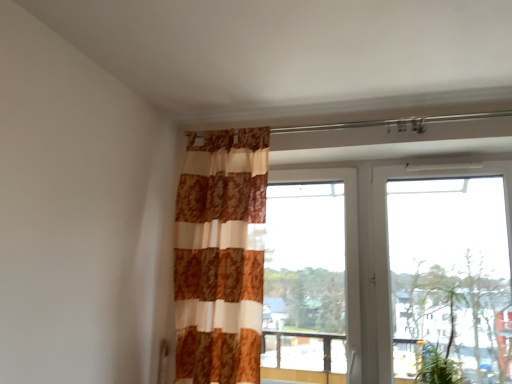
Where is `transparent glass window at center, acting as the 2th window starting from the right`? The width and height of the screenshot is (512, 384). transparent glass window at center, acting as the 2th window starting from the right is located at coordinates (345, 236).

At what (x,y) coordinates should I click in order to perform the action: click on white plastic window at upper right, the 1th window viewed from the right. Please return your answer as a coordinate pair (x, y). Looking at the image, I should click on (375, 250).

Is transparent glass window at center, acting as the 2th window starting from the right, positioned beyond the bounds of patterned fabric curtain at center?

Yes, transparent glass window at center, acting as the 2th window starting from the right, is located beyond the bounds of patterned fabric curtain at center.

Does transparent glass window at center, arranged as the 1th window when viewed from the left, appear on the right side of patterned fabric curtain at center?

Indeed, transparent glass window at center, arranged as the 1th window when viewed from the left, is positioned on the right side of patterned fabric curtain at center.

Are transparent glass window at center, acting as the 2th window starting from the right, and patterned fabric curtain at center making contact?

No, transparent glass window at center, acting as the 2th window starting from the right, is not next to patterned fabric curtain at center.

From the image's perspective, would you say transparent glass window at center, arranged as the 1th window when viewed from the left, is positioned over patterned fabric curtain at center?

No.

From the image's perspective, is green leafy plant at lower right located above or below transparent glass window at center, acting as the 2th window starting from the right?

green leafy plant at lower right is below transparent glass window at center, acting as the 2th window starting from the right.

Can you tell me how much green leafy plant at lower right and transparent glass window at center, arranged as the 1th window when viewed from the left, differ in facing direction?

The angular difference between green leafy plant at lower right and transparent glass window at center, arranged as the 1th window when viewed from the left, is 0.414 degrees.

Considering the positions of objects green leafy plant at lower right and transparent glass window at center, acting as the 2th window starting from the right, in the image provided, who is more to the left, green leafy plant at lower right or transparent glass window at center, acting as the 2th window starting from the right,?

Positioned to the left is transparent glass window at center, acting as the 2th window starting from the right.

Does transparent glass window at center, arranged as the 1th window when viewed from the left, turn towards white plastic window at upper right, the 1th window viewed from the right?

No, transparent glass window at center, arranged as the 1th window when viewed from the left, is not oriented towards white plastic window at upper right, the 1th window viewed from the right.

Measure the distance between transparent glass window at center, arranged as the 1th window when viewed from the left, and white plastic window at upper right, the 1th window viewed from the right.

transparent glass window at center, arranged as the 1th window when viewed from the left, is 4.02 inches away from white plastic window at upper right, the 1th window viewed from the right.

Would you say transparent glass window at center, arranged as the 1th window when viewed from the left, is inside or outside white plastic window at upper right, the 1th window viewed from the right?

The correct answer is: outside.

Where is `window directly beneath the white plastic window at upper right, the 2th window when ordered from left to right (from a real-world perspective)`? Image resolution: width=512 pixels, height=384 pixels. window directly beneath the white plastic window at upper right, the 2th window when ordered from left to right (from a real-world perspective) is located at coordinates (345, 236).

Is white plastic window at upper right, the 1th window viewed from the right, located outside patterned fabric curtain at center?

Yes, white plastic window at upper right, the 1th window viewed from the right, is outside of patterned fabric curtain at center.

Is white plastic window at upper right, the 1th window viewed from the right, wider than patterned fabric curtain at center?

No, white plastic window at upper right, the 1th window viewed from the right, is not wider than patterned fabric curtain at center.

Is the position of white plastic window at upper right, the 1th window viewed from the right, less distant than that of patterned fabric curtain at center?

Yes, white plastic window at upper right, the 1th window viewed from the right, is closer to the camera.

Who is shorter, white plastic window at upper right, the 2th window when ordered from left to right, or patterned fabric curtain at center?

Standing shorter between the two is white plastic window at upper right, the 2th window when ordered from left to right.

Is white plastic window at upper right, the 1th window viewed from the right, located outside transparent glass window at center, acting as the 2th window starting from the right?

Yes, white plastic window at upper right, the 1th window viewed from the right, is outside of transparent glass window at center, acting as the 2th window starting from the right.

From the image's perspective, which one is positioned lower, white plastic window at upper right, the 2th window when ordered from left to right, or transparent glass window at center, arranged as the 1th window when viewed from the left?

transparent glass window at center, arranged as the 1th window when viewed from the left.

Based on the photo, from a real-world perspective, is white plastic window at upper right, the 1th window viewed from the right, over transparent glass window at center, arranged as the 1th window when viewed from the left?

Yes, from a real-world perspective, white plastic window at upper right, the 1th window viewed from the right, is over transparent glass window at center, arranged as the 1th window when viewed from the left

The height and width of the screenshot is (384, 512). What are the coordinates of `window that appears in front of the green leafy plant at lower right` in the screenshot? It's located at (375, 250).

Between white plastic window at upper right, the 2th window when ordered from left to right, and green leafy plant at lower right, which one has more height?

With more height is white plastic window at upper right, the 2th window when ordered from left to right.

From the image's perspective, is white plastic window at upper right, the 1th window viewed from the right, positioned above or below green leafy plant at lower right?

white plastic window at upper right, the 1th window viewed from the right, is situated higher than green leafy plant at lower right in the image.

In the scene shown: Is white plastic window at upper right, the 2th window when ordered from left to right, placed right next to green leafy plant at lower right?

No, white plastic window at upper right, the 2th window when ordered from left to right, is not beside green leafy plant at lower right.

Between point (443, 290) and point (179, 325), which one is positioned behind?

The point (179, 325) is farther.

Looking at the image, does green leafy plant at lower right seem bigger or smaller compared to patterned fabric curtain at center?

In the image, green leafy plant at lower right appears to be smaller than patterned fabric curtain at center.

Can you see green leafy plant at lower right touching patterned fabric curtain at center?

No, green leafy plant at lower right is not next to patterned fabric curtain at center.

Image resolution: width=512 pixels, height=384 pixels. I want to click on curtain located in front of the transparent glass window at center, arranged as the 1th window when viewed from the left, so click(220, 256).

Identify the location of plant below the transparent glass window at center, acting as the 2th window starting from the right (from a real-world perspective). This screenshot has height=384, width=512. (448, 322).

Estimate the real-world distances between objects in this image. Which object is further from patterned fabric curtain at center, transparent glass window at center, arranged as the 1th window when viewed from the left, or white plastic window at upper right, the 2th window when ordered from left to right?

white plastic window at upper right, the 2th window when ordered from left to right, lies further to patterned fabric curtain at center than the other object.

When comparing their distances from patterned fabric curtain at center, does transparent glass window at center, acting as the 2th window starting from the right, or green leafy plant at lower right seem closer?

Among the two, transparent glass window at center, acting as the 2th window starting from the right, is located nearer to patterned fabric curtain at center.

When comparing their distances from transparent glass window at center, arranged as the 1th window when viewed from the left, does patterned fabric curtain at center or green leafy plant at lower right seem further?

Based on the image, patterned fabric curtain at center appears to be further to transparent glass window at center, arranged as the 1th window when viewed from the left.

When comparing their distances from transparent glass window at center, arranged as the 1th window when viewed from the left, does green leafy plant at lower right or white plastic window at upper right, the 1th window viewed from the right, seem further?

green leafy plant at lower right is further to transparent glass window at center, arranged as the 1th window when viewed from the left.

Based on their spatial positions, is transparent glass window at center, acting as the 2th window starting from the right, or patterned fabric curtain at center closer to green leafy plant at lower right?

transparent glass window at center, acting as the 2th window starting from the right, is positioned closer to the anchor green leafy plant at lower right.

From the image, which object appears to be nearer to patterned fabric curtain at center, green leafy plant at lower right or transparent glass window at center, acting as the 2th window starting from the right?

Based on the image, transparent glass window at center, acting as the 2th window starting from the right, appears to be nearer to patterned fabric curtain at center.

Looking at the image, which one is located further to green leafy plant at lower right, transparent glass window at center, acting as the 2th window starting from the right, or white plastic window at upper right, the 2th window when ordered from left to right?

transparent glass window at center, acting as the 2th window starting from the right.

When comparing their distances from green leafy plant at lower right, does patterned fabric curtain at center or white plastic window at upper right, the 1th window viewed from the right, seem closer?

white plastic window at upper right, the 1th window viewed from the right, is positioned closer to the anchor green leafy plant at lower right.

You are a GUI agent. You are given a task and a screenshot of the screen. Output one action in this format:
    pyautogui.click(x=<x>, y=<y>)
    Task: Click on the plant between patterned fabric curtain at center and white plastic window at upper right, the 1th window viewed from the right, from left to right
    The width and height of the screenshot is (512, 384).
    Given the screenshot: What is the action you would take?
    pyautogui.click(x=448, y=322)

At what (x,y) coordinates should I click in order to perform the action: click on window between patterned fabric curtain at center and green leafy plant at lower right. Please return your answer as a coordinate pair (x, y). This screenshot has height=384, width=512. Looking at the image, I should click on tap(345, 236).

I want to click on window between patterned fabric curtain at center and white plastic window at upper right, the 2th window when ordered from left to right, so click(x=345, y=236).

At what (x,y) coordinates should I click in order to perform the action: click on plant located between transparent glass window at center, arranged as the 1th window when viewed from the left, and white plastic window at upper right, the 2th window when ordered from left to right, in the left-right direction. Please return your answer as a coordinate pair (x, y). The image size is (512, 384). Looking at the image, I should click on (448, 322).